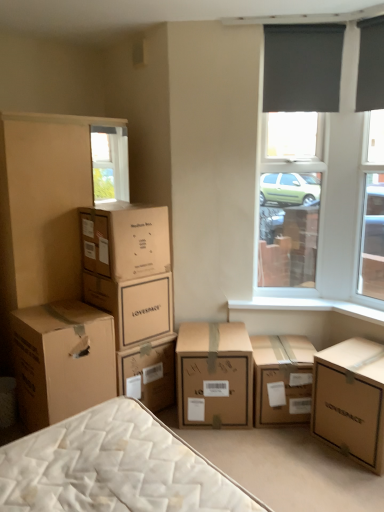
Question: From the image's perspective, does black matte window screen at upper right appear lower than brown cardboard box at center, positioned as the fourth box in left-to-right order?

Choices:
 (A) no
 (B) yes

Answer: (A)

Question: Is black matte window screen at upper right thinner than brown cardboard box at center, positioned as the fourth box in left-to-right order?

Choices:
 (A) no
 (B) yes

Answer: (B)

Question: Is black matte window screen at upper right in front of brown cardboard box at center, positioned as the fourth box in left-to-right order?

Choices:
 (A) yes
 (B) no

Answer: (B)

Question: Is black matte window screen at upper right at the left side of brown cardboard box at center, which is the 3th box from right to left?

Choices:
 (A) yes
 (B) no

Answer: (B)

Question: Is black matte window screen at upper right completely or partially outside of brown cardboard box at center, which is the 3th box from right to left?

Choices:
 (A) yes
 (B) no

Answer: (A)

Question: Can you confirm if black matte window screen at upper right is smaller than brown cardboard box at center, positioned as the fourth box in left-to-right order?

Choices:
 (A) yes
 (B) no

Answer: (A)

Question: Considering the relative sizes of brown cardboard box at upper left, positioned as the second box in left-to-right order, and lovespace cardboard box at lower right, which is counted as the sixth box, starting from the left, in the image provided, is brown cardboard box at upper left, positioned as the second box in left-to-right order, taller than lovespace cardboard box at lower right, which is counted as the sixth box, starting from the left,?

Choices:
 (A) no
 (B) yes

Answer: (A)

Question: Can you confirm if brown cardboard box at upper left, placed as the 5th box when sorted from right to left, is thinner than lovespace cardboard box at lower right, acting as the first box starting from the right?

Choices:
 (A) no
 (B) yes

Answer: (B)

Question: Is there a large distance between brown cardboard box at upper left, positioned as the second box in left-to-right order, and lovespace cardboard box at lower right, which is counted as the sixth box, starting from the left?

Choices:
 (A) no
 (B) yes

Answer: (B)

Question: Is the depth of brown cardboard box at upper left, placed as the 5th box when sorted from right to left, greater than that of lovespace cardboard box at lower right, which is counted as the sixth box, starting from the left?

Choices:
 (A) yes
 (B) no

Answer: (A)

Question: Is brown cardboard box at upper left, positioned as the second box in left-to-right order, oriented away from lovespace cardboard box at lower right, which is counted as the sixth box, starting from the left?

Choices:
 (A) no
 (B) yes

Answer: (A)

Question: Is brown cardboard box at upper left, positioned as the second box in left-to-right order, at the left side of lovespace cardboard box at lower right, which is counted as the sixth box, starting from the left?

Choices:
 (A) no
 (B) yes

Answer: (B)

Question: From the image's perspective, is brown cardboard box at lower left, the 6th box when ordered from right to left, beneath brown cardboard box at center-left, the 4th box when ordered from right to left?

Choices:
 (A) no
 (B) yes

Answer: (B)